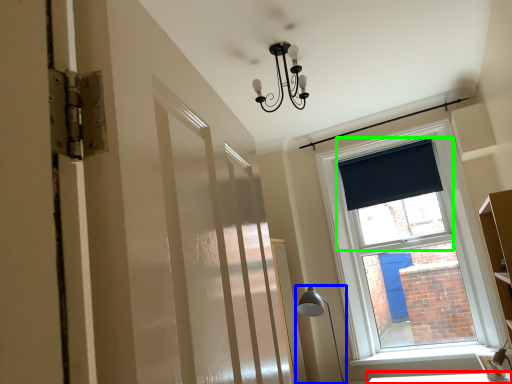
Question: Based on their relative distances, which object is farther from table (highlighted by a red box)? Choose from table lamp (highlighted by a blue box) and window screen (highlighted by a green box).

Choices:
 (A) table lamp
 (B) window screen

Answer: (B)